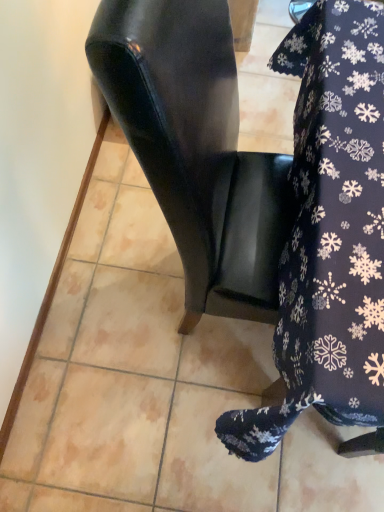
Measure the distance between point (194, 285) and camera.

The distance of point (194, 285) from camera is 37.76 inches.

What do you see at coordinates (196, 149) in the screenshot?
I see `glossy black chair at center` at bounding box center [196, 149].

Where is `glossy black chair at center`? This screenshot has height=512, width=384. glossy black chair at center is located at coordinates (196, 149).

Consider the image. What is the approximate width of glossy black chair at center?

It is 25.05 inches.

Find the location of a particular element. The image size is (384, 512). glossy black chair at center is located at coordinates (196, 149).